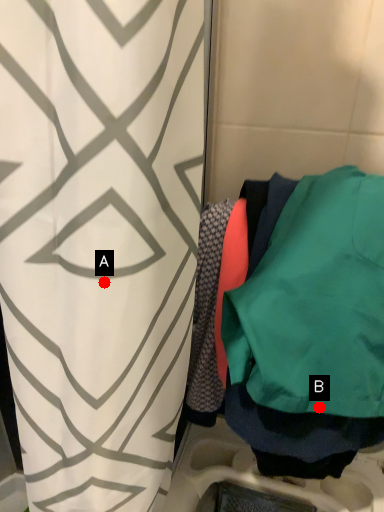
Question: Two points are circled on the image, labeled by A and B beside each circle. Which point is closer to the camera taking this photo?

Choices:
 (A) A is closer
 (B) B is closer

Answer: (A)